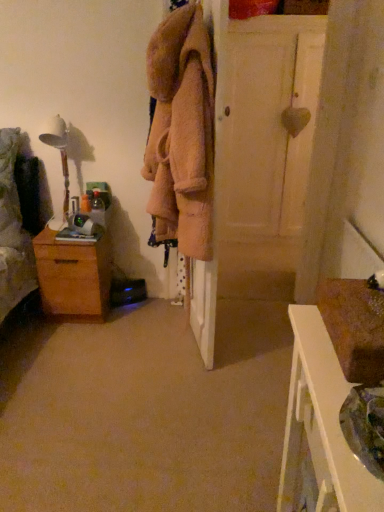
Question: From the image's perspective, does white wood nightstand at lower right appear lower than white matte door at center?

Choices:
 (A) yes
 (B) no

Answer: (A)

Question: From a real-world perspective, is white wood nightstand at lower right physically above white matte door at center?

Choices:
 (A) no
 (B) yes

Answer: (A)

Question: Is white wood nightstand at lower right positioned with its back to white matte door at center?

Choices:
 (A) no
 (B) yes

Answer: (A)

Question: Is white matte door at center surrounded by white wood nightstand at lower right?

Choices:
 (A) no
 (B) yes

Answer: (A)

Question: Is white wood nightstand at lower right in front of white matte door at center?

Choices:
 (A) no
 (B) yes

Answer: (B)

Question: Looking at the image, does white wood nightstand at lower right seem bigger or smaller compared to fuzzy beige coat at center?

Choices:
 (A) small
 (B) big

Answer: (B)

Question: Relative to fuzzy beige coat at center, is white wood nightstand at lower right in front or behind?

Choices:
 (A) front
 (B) behind

Answer: (A)

Question: Based on their positions, is white wood nightstand at lower right located to the left or right of fuzzy beige coat at center?

Choices:
 (A) right
 (B) left

Answer: (A)

Question: Is point (357, 460) positioned closer to the camera than point (192, 10)?

Choices:
 (A) farther
 (B) closer

Answer: (B)

Question: From a real-world perspective, is wooden table lamp at left positioned above or below white wood nightstand at lower right?

Choices:
 (A) below
 (B) above

Answer: (B)

Question: Visually, is wooden table lamp at left positioned to the left or to the right of white wood nightstand at lower right?

Choices:
 (A) left
 (B) right

Answer: (A)

Question: From the image's perspective, is wooden table lamp at left positioned above or below white wood nightstand at lower right?

Choices:
 (A) below
 (B) above

Answer: (B)

Question: Does point (64, 136) appear closer or farther from the camera than point (324, 485)?

Choices:
 (A) closer
 (B) farther

Answer: (B)

Question: From a real-world perspective, relative to white matte door at center, is fuzzy beige coat at center vertically above or below?

Choices:
 (A) below
 (B) above

Answer: (B)

Question: Looking at their shapes, would you say fuzzy beige coat at center is wider or thinner than white matte door at center?

Choices:
 (A) thin
 (B) wide

Answer: (A)